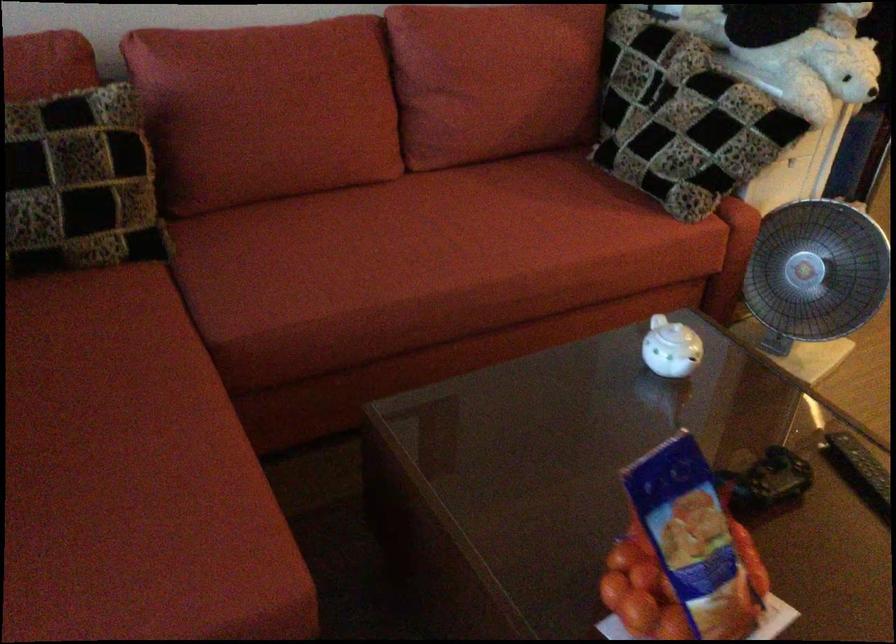
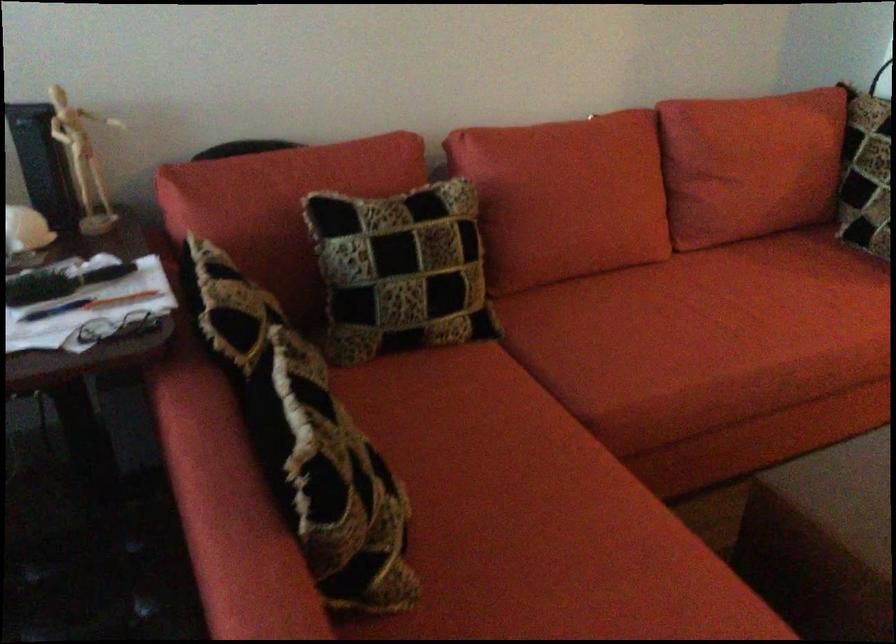
Where in the second image is the point corresponding to (409,247) from the first image?

(726, 323)